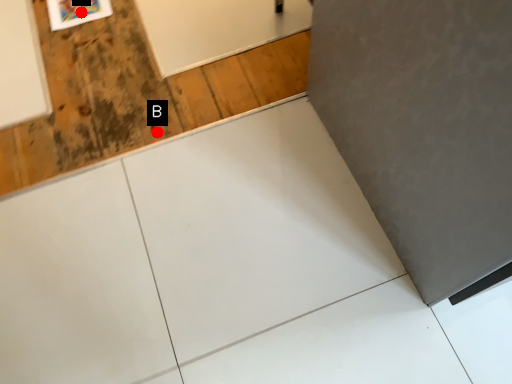
Question: Two points are circled on the image, labeled by A and B beside each circle. Among these points, which one is farthest from the camera?

Choices:
 (A) A is further
 (B) B is further

Answer: (A)